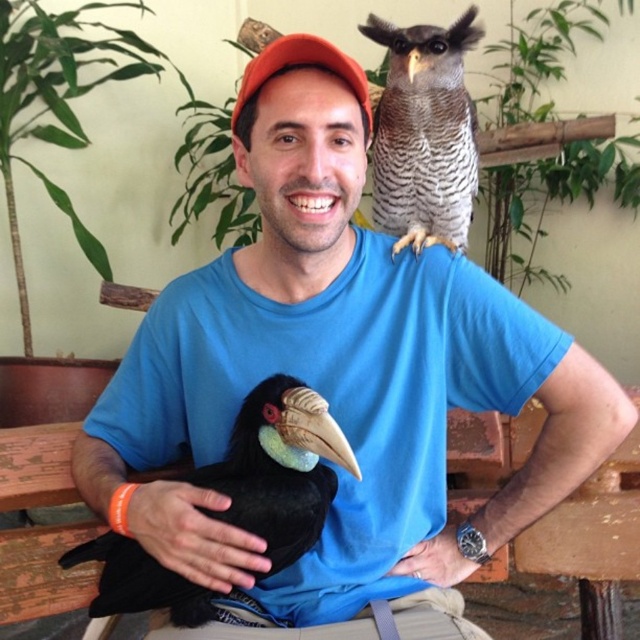
Question: Which point is farther to the camera?

Choices:
 (A) black matte hornbill at lower left
 (B) zebra-striped feathers owl at upper right

Answer: (B)

Question: Does black matte hornbill at lower left appear over zebra-striped feathers owl at upper right?

Choices:
 (A) yes
 (B) no

Answer: (B)

Question: Considering the relative positions of black matte hornbill at lower left and zebra-striped feathers owl at upper right in the image provided, where is black matte hornbill at lower left located with respect to zebra-striped feathers owl at upper right?

Choices:
 (A) left
 (B) right

Answer: (A)

Question: Can you confirm if black matte hornbill at lower left is positioned below zebra-striped feathers owl at upper right?

Choices:
 (A) no
 (B) yes

Answer: (B)